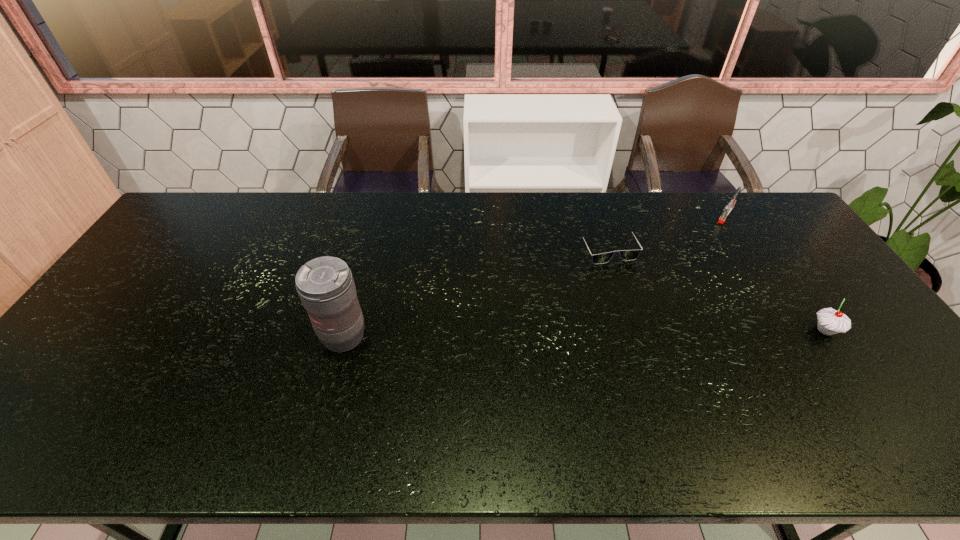
The image size is (960, 540). In the image, there is a desktop. Identify the location of vacant space at the far edge. (444, 222).

At what (x,y) coordinates should I click in order to perform the action: click on free location at the near edge. Please return your answer as a coordinate pair (x, y). This screenshot has height=540, width=960. Looking at the image, I should click on (644, 380).

This screenshot has height=540, width=960. I want to click on free location at the left edge, so click(60, 364).

At what (x,y) coordinates should I click in order to perform the action: click on vacant space at the right edge of the desktop. Please return your answer as a coordinate pair (x, y). Looking at the image, I should click on (793, 266).

In the image, there is a desktop. Where is `vacant space at the far left corner`? This screenshot has width=960, height=540. vacant space at the far left corner is located at coordinates (200, 210).

This screenshot has width=960, height=540. I want to click on free location at the near left corner of the desktop, so click(51, 384).

I want to click on vacant space that's between the cupcake and the third tallest object, so click(776, 273).

Locate an element on the screen. free space between the cupcake and the sunglasses is located at coordinates (716, 288).

Find the location of a particular element. This screenshot has height=540, width=960. vacant region between the farthest object and the third shortest object is located at coordinates (776, 273).

The height and width of the screenshot is (540, 960). Identify the location of vacant area that lies between the cupcake and the second shortest object. (776, 273).